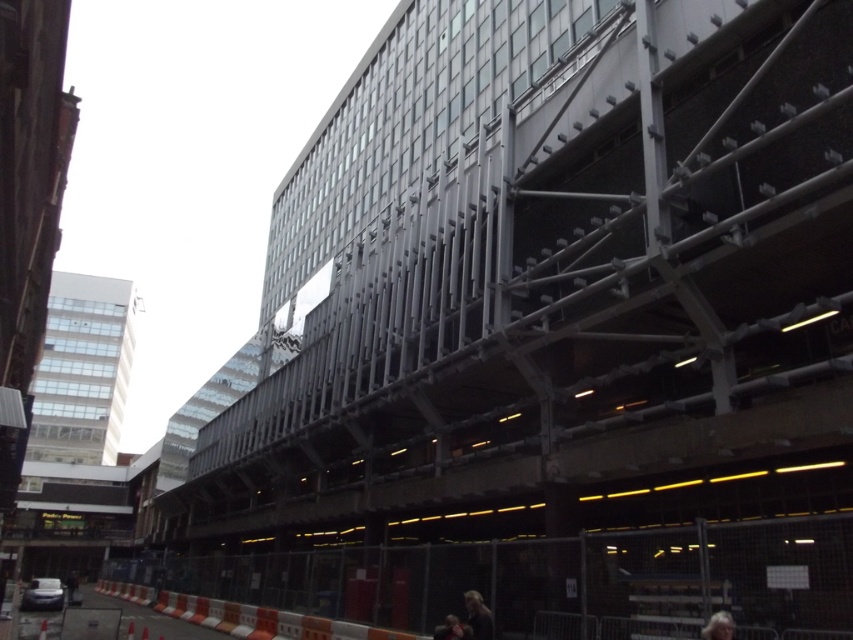
You are a delivery person carrying a package and need to navigate between the light brown hair at lower center and the gray hair at lower right to reach the entrance of the building. Is there enough space to pass through the gap between them?

The distance between the light brown hair at lower center and the gray hair at lower right is 11.76 feet, which should provide sufficient space for a delivery person carrying a package to pass through comfortably.

You are a delivery person standing at the entrance of the building. You need to locate the person with light brown hair at lower center to deliver a package. According to the coordinates provided, where should you look to find them?

The light brown hair at lower center is located at coordinates point (x=479, y=616), so you should look towards the lower center area of the image to find the person.